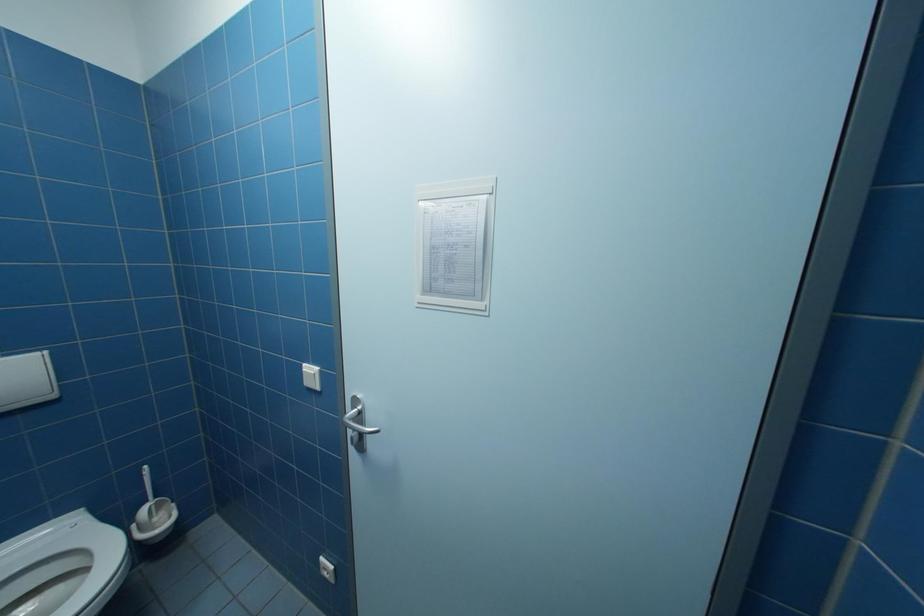
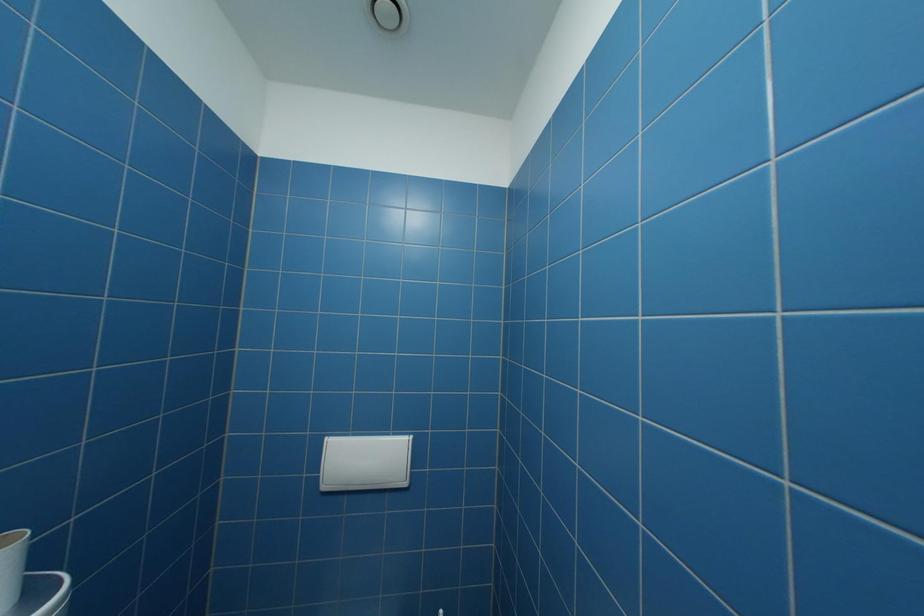
Question: The images are taken continuously from a first-person perspective. In which direction is your viewpoint rotating?

Choices:
 (A) Left
 (B) Right
 (C) Up
 (D) Down

Answer: (A)